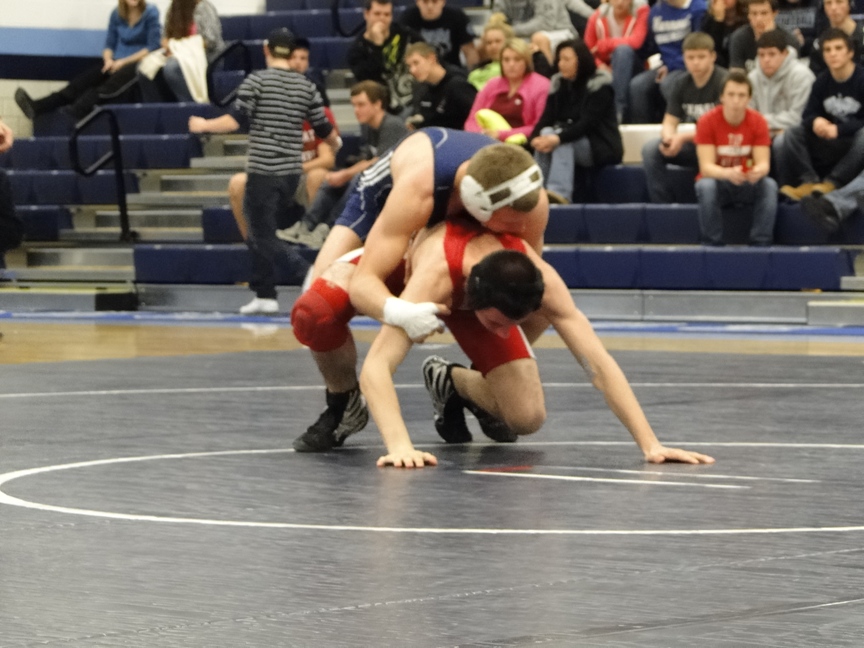
Locate an element on the screen. mat is located at coordinates (245, 476).